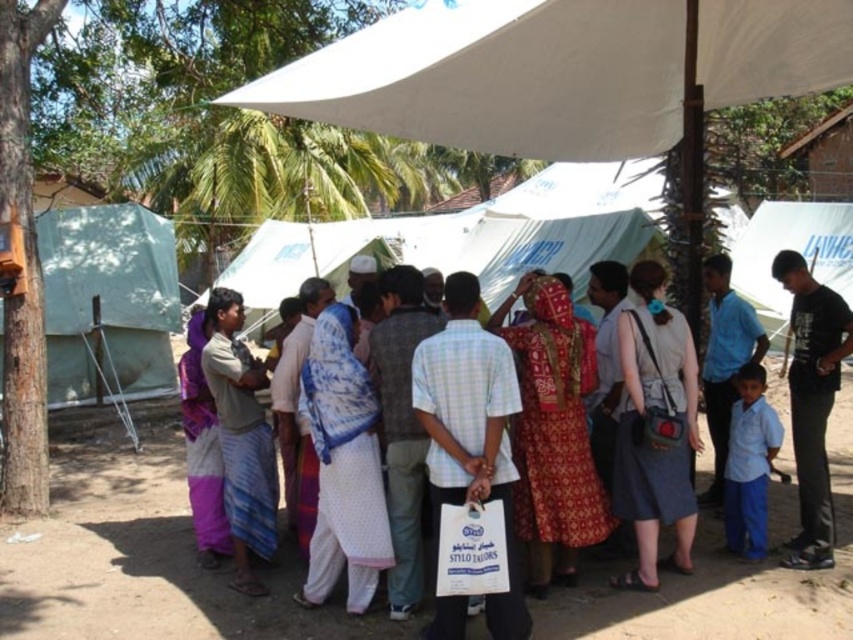
You are a photographer standing at the edge of the sandy area, wanting to capture a photo of the red printed dress at center and the white dotted fabric at center. If your camera has a maximum focus range of 3 feet, will you be able to capture both subjects clearly in the same frame?

The red printed dress at center is 3.41 feet from the white dotted fabric at center. Since the distance between them is slightly over the camera maximum focus range of 3 feet, you might not be able to capture both subjects clearly in the same frame.

There is a point at coordinate [553,432] in the image. Based on the scene description, what object is this point located on?

The point at coordinate [553,432] is located on the red printed dress at center.